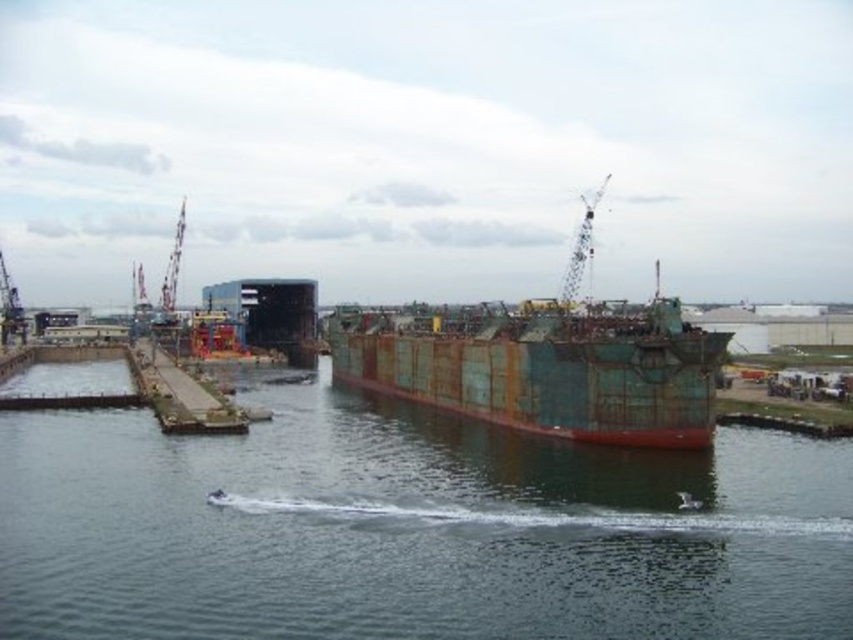
You are standing at the center of the shipyard and want to locate the metallic wireframe crane at upper center. Which direction should you look to find it?

You should look to the upper center direction to find the metallic wireframe crane at upper center as it is located at point (579,248).

You are standing at the point labeled point (589, 202) and want to walk towards the point labeled point (173, 300). Which direction should you move relative to your current position?

You should move downward and to the right because point (173, 300) is lower and further to the right compared to point (589, 202).

You are a crane operator who needs to lower a heavy load onto the rustic concrete dock at center. The metallic wireframe crane at upper center has a maximum reach of 50 meters. Can you safely lower the load onto the dock without the crane tipping over?

The metallic wireframe crane at upper center is taller than the rustic concrete dock at center. Since the crane has a maximum reach of 50 meters and the dock is shorter, the operator can safely lower the load onto the dock without the crane tipping over as long as the distance between them is within the 50 meters limit.